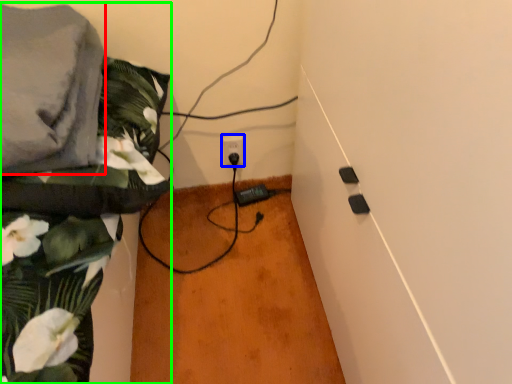
Question: Considering the real-world distances, which object is closest to linen (highlighted by a red box)? power plugs and sockets (highlighted by a blue box) or textile (highlighted by a green box).

Choices:
 (A) power plugs and sockets
 (B) textile

Answer: (B)